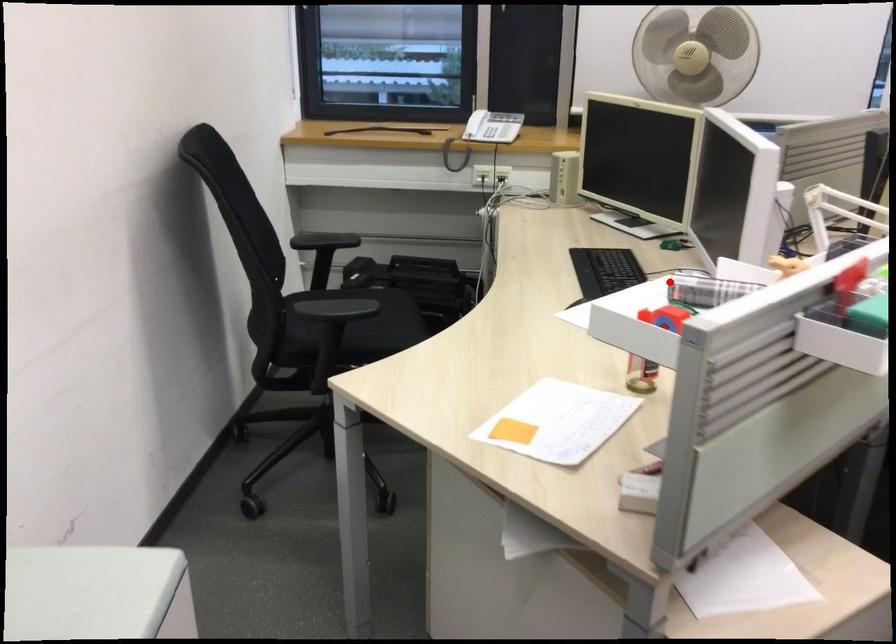
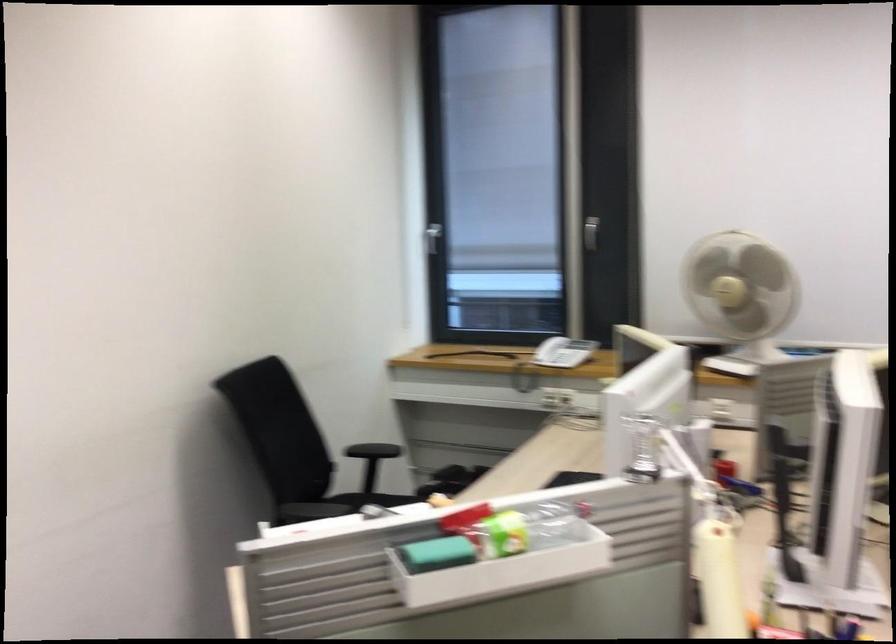
Question: I am providing you with two images of the same scene from different viewpoints. Image1 has a red point marked. In image2, the corresponding 3D location appears at what relative position? Reply with the corresponding letter.

Choices:
 (A) Closer
 (B) Farther

Answer: (B)